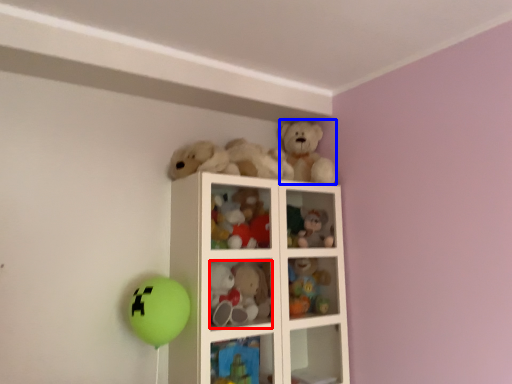
Question: Among these objects, which one is farthest to the camera, toy (highlighted by a red box) or toy (highlighted by a blue box)?

Choices:
 (A) toy
 (B) toy

Answer: (B)